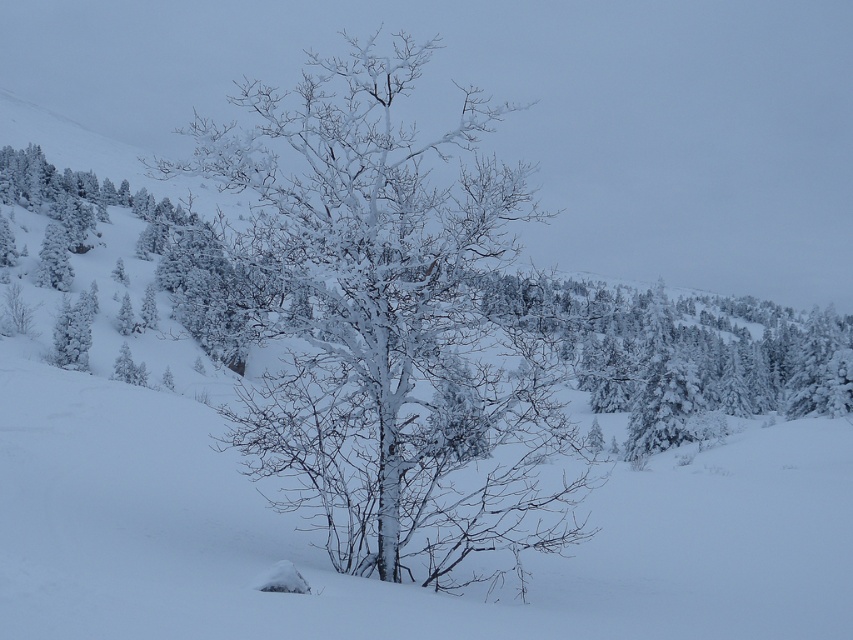
Can you confirm if snow-covered branches at center is shorter than white frosty tree at upper left?

No, snow-covered branches at center is not shorter than white frosty tree at upper left.

Is snow-covered branches at center to the left of white frosty tree at upper left from the viewer's perspective?

Incorrect, snow-covered branches at center is not on the left side of white frosty tree at upper left.

You are a GUI agent. You are given a task and a screenshot of the screen. Output one action in this format:
    pyautogui.click(x=<x>, y=<y>)
    Task: Click on the snow-covered branches at center
    
    Given the screenshot: What is the action you would take?
    pyautogui.click(x=393, y=328)

Locate an element on the screen. The height and width of the screenshot is (640, 853). snow-covered branches at center is located at coordinates (393, 328).